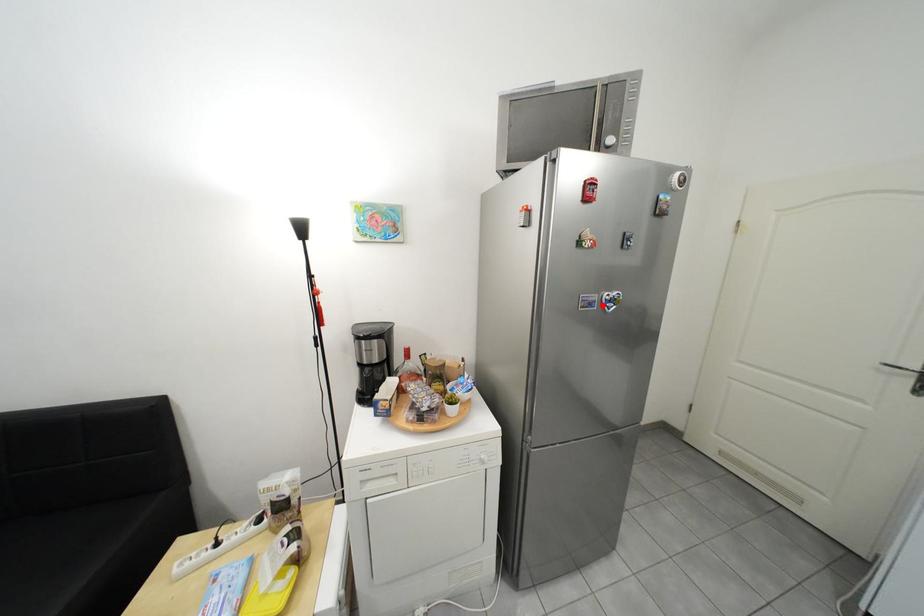
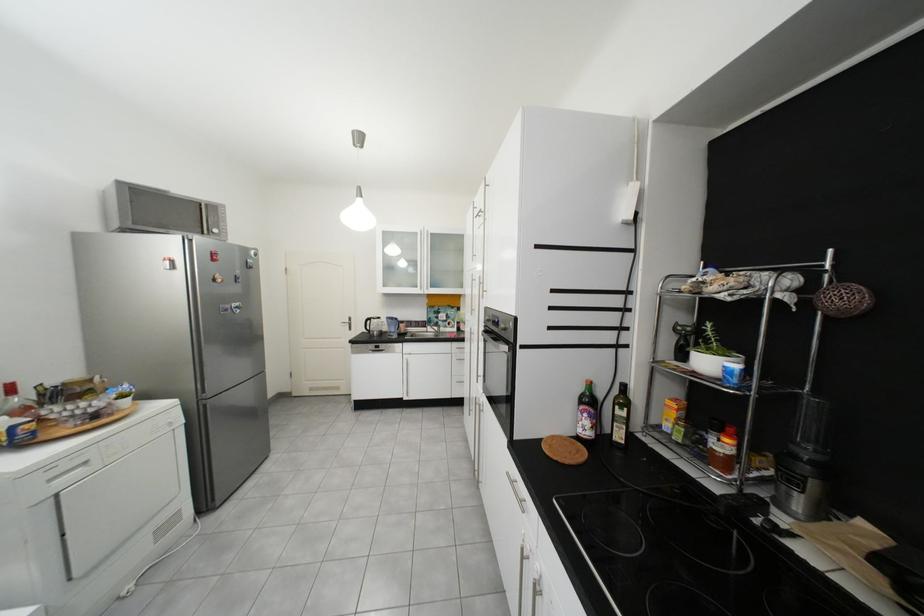
The point at the highlighted location is marked in the first image. Where is the corresponding point in the second image?

(237, 310)